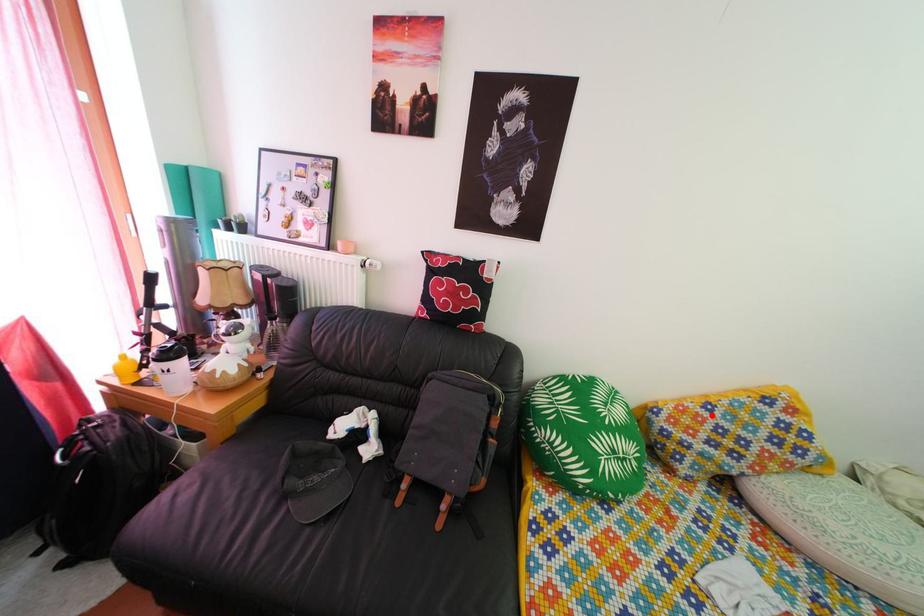
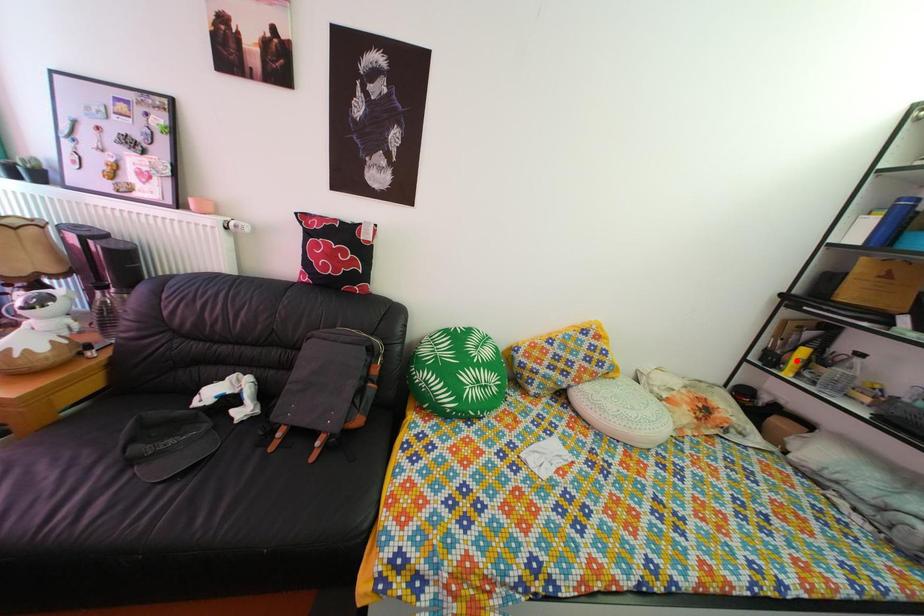
I am providing you with two images of the same scene from different viewpoints. A red point is marked on the first image and another point is marked on the second image. Do the highlighted points in image1 and image2 indicate the same real-world spot?

No